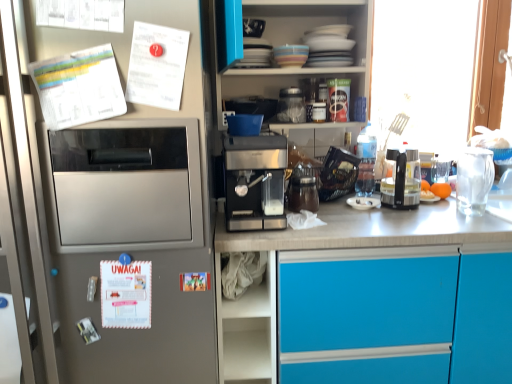
Where is `blank area to the left of black plastic coffee machine at center`? Image resolution: width=512 pixels, height=384 pixels. blank area to the left of black plastic coffee machine at center is located at coordinates (359, 213).